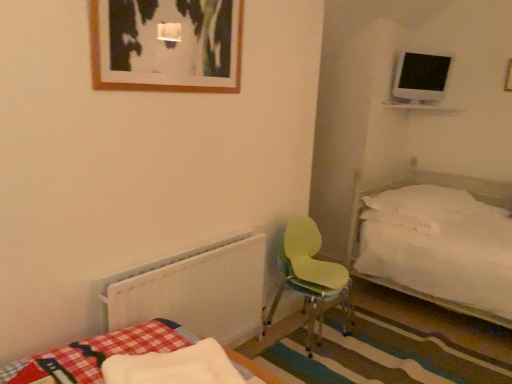
Question: Is white fluffy mattress at lower left situated inside white plastic radiator at lower left or outside?

Choices:
 (A) outside
 (B) inside

Answer: (A)

Question: From a real-world perspective, is white fluffy mattress at lower left positioned above or below white plastic radiator at lower left?

Choices:
 (A) below
 (B) above

Answer: (B)

Question: Which of these objects is positioned closest to the wooden picture frame at upper center?

Choices:
 (A) white fluffy mattress at lower left
 (B) light green plastic chair at center
 (C) white plastic radiator at lower left
 (D) white soft pillow at right

Answer: (C)

Question: Which of these objects is positioned closest to the white plastic radiator at lower left?

Choices:
 (A) white fluffy mattress at lower left
 (B) white soft pillow at right
 (C) wooden picture frame at upper center
 (D) light green plastic chair at center

Answer: (A)